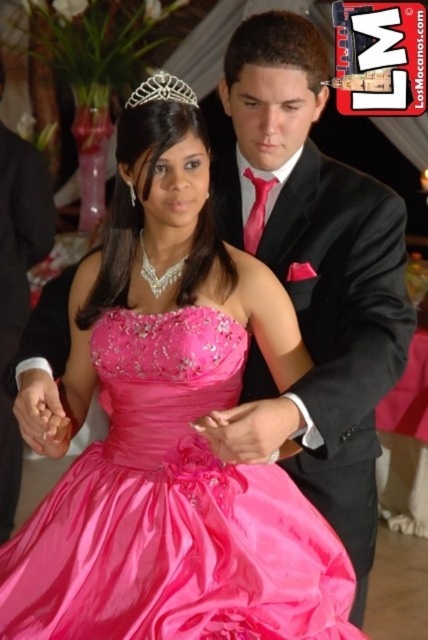
What do you see at coordinates (172, 512) in the screenshot? I see `shiny taffeta dress at center` at bounding box center [172, 512].

Which of these two, shiny taffeta dress at center or black satin suit at center, stands shorter?

With less height is shiny taffeta dress at center.

Find the location of a particular element. This screenshot has height=640, width=428. shiny taffeta dress at center is located at coordinates (172, 512).

Does shiny taffeta dress at center have a larger size compared to silver metallic tiara at upper center?

Yes, shiny taffeta dress at center is bigger than silver metallic tiara at upper center.

Is shiny taffeta dress at center taller than silver metallic tiara at upper center?

Yes.

Where is `shiny taffeta dress at center`? shiny taffeta dress at center is located at coordinates (172, 512).

Does black satin suit at center appear under silver metallic tiara at upper center?

Yes, black satin suit at center is below silver metallic tiara at upper center.

Who is higher up, black satin suit at center or silver metallic tiara at upper center?

silver metallic tiara at upper center

Find the location of a particular element. This screenshot has width=428, height=640. black satin suit at center is located at coordinates (17, 285).